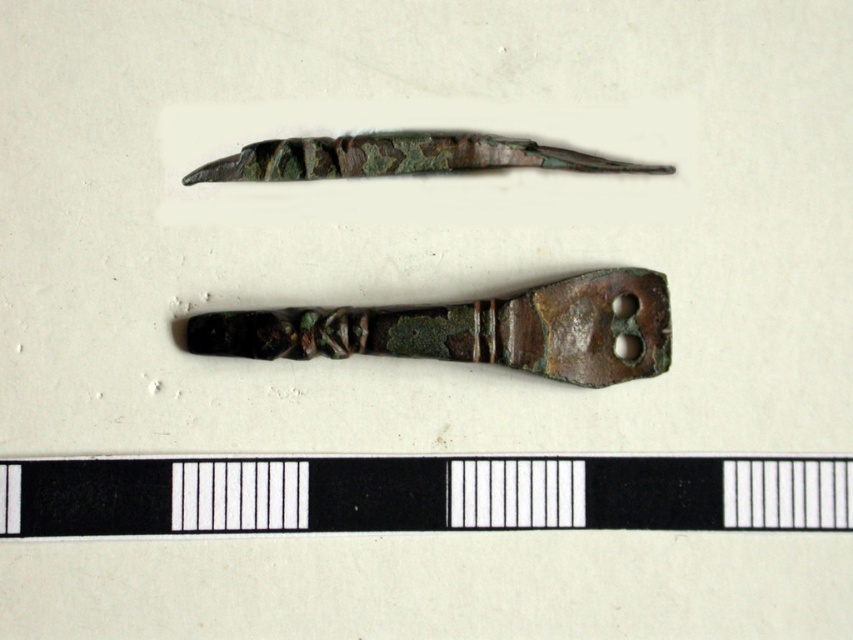
Question: Where is black matte ruler at bottom located in relation to rusty bronze handle at center in the image?

Choices:
 (A) right
 (B) left

Answer: (B)

Question: Which is nearer to the black matte ruler at bottom?

Choices:
 (A) rusty bronze handle at center
 (B) green patina metal razor at upper center

Answer: (A)

Question: Which of the following is the farthest from the observer?

Choices:
 (A) (413, 160)
 (B) (258, 490)

Answer: (B)

Question: Among these objects, which one is nearest to the camera?

Choices:
 (A) black matte ruler at bottom
 (B) rusty bronze handle at center
 (C) green patina metal razor at upper center

Answer: (A)

Question: Can you confirm if black matte ruler at bottom is positioned to the right of green patina metal razor at upper center?

Choices:
 (A) no
 (B) yes

Answer: (A)

Question: Can you confirm if black matte ruler at bottom is thinner than green patina metal razor at upper center?

Choices:
 (A) no
 (B) yes

Answer: (A)